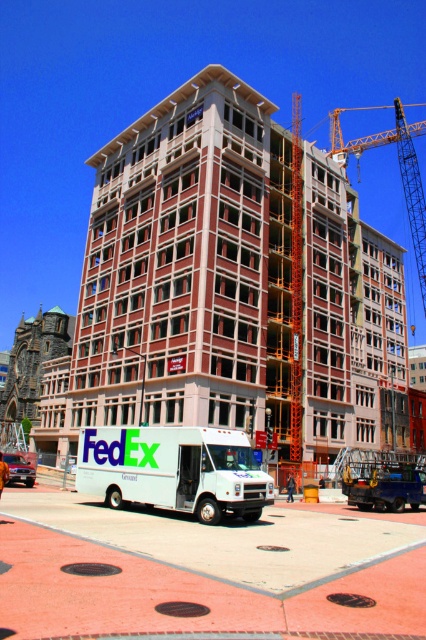
You are a delivery driver who needs to park your white matte fedex truck at center in a parking spot that can only accommodate vehicles smaller than the orange metallic crane at upper right. Can your truck fit in the parking spot?

The white matte fedex truck at center occupies less space than the orange metallic crane at upper right, so it can fit in the parking spot designed for smaller vehicles.

You are a construction worker standing near the white matte fedex truck at center and the orange metallic crane at upper right. Which object is nearer to you?

The white matte fedex truck at center is closer to the viewer than the orange metallic crane at upper right, so the white matte fedex truck at center is nearer to you.